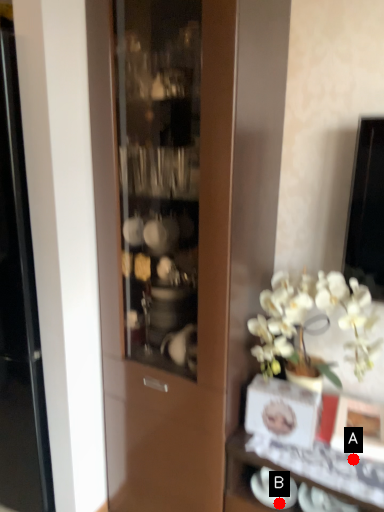
Question: Two points are circled on the image, labeled by A and B beside each circle. Among these points, which one is farthest from the camera?

Choices:
 (A) A is further
 (B) B is further

Answer: (B)